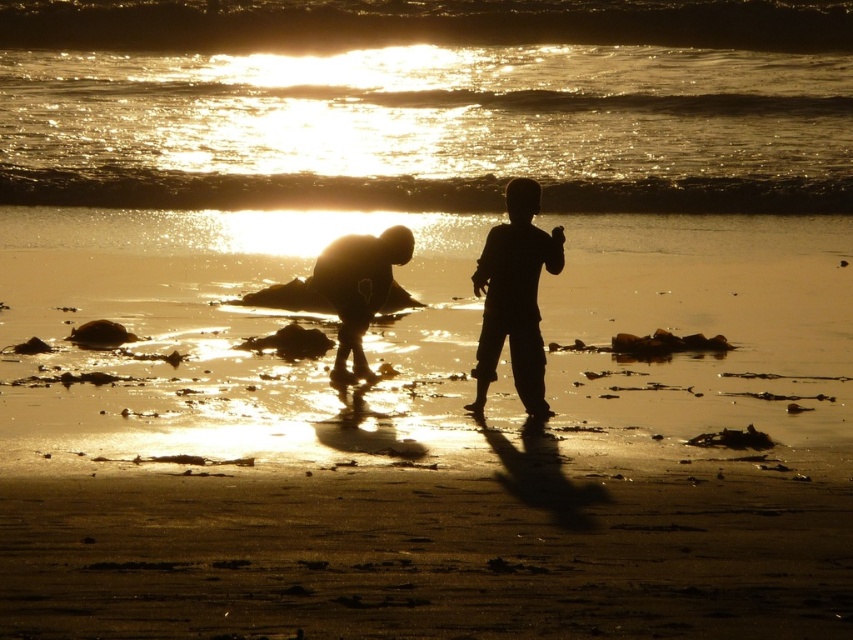
You are a photographer trying to capture the sunset scene. You notice the silhouette figure at center and the silhouette sand at lower center. Which object would cast a longer shadow on the wet sand?

The silhouette figure at center is much taller than the silhouette sand at lower center, so it would cast a longer shadow on the wet sand.

You are a photographer trying to capture the sunset at the beach. You notice the silhouette figure at center and the silhouette sand at lower center. Which object in the scene is smaller in size?

The silhouette figure at center is smaller in size compared to the silhouette sand at lower center.